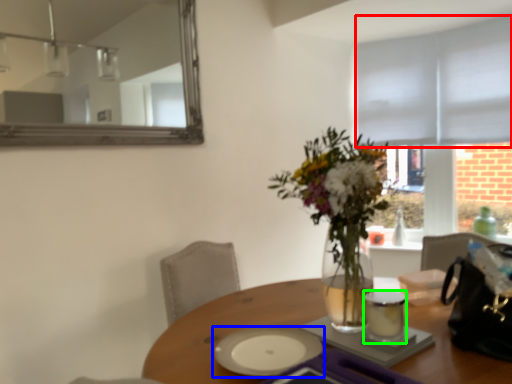
Question: Estimate the real-world distances between objects in this image. Which object is closer to blind (highlighted by a red box), tableware (highlighted by a blue box) or tableware (highlighted by a green box)?

Choices:
 (A) tableware
 (B) tableware

Answer: (B)